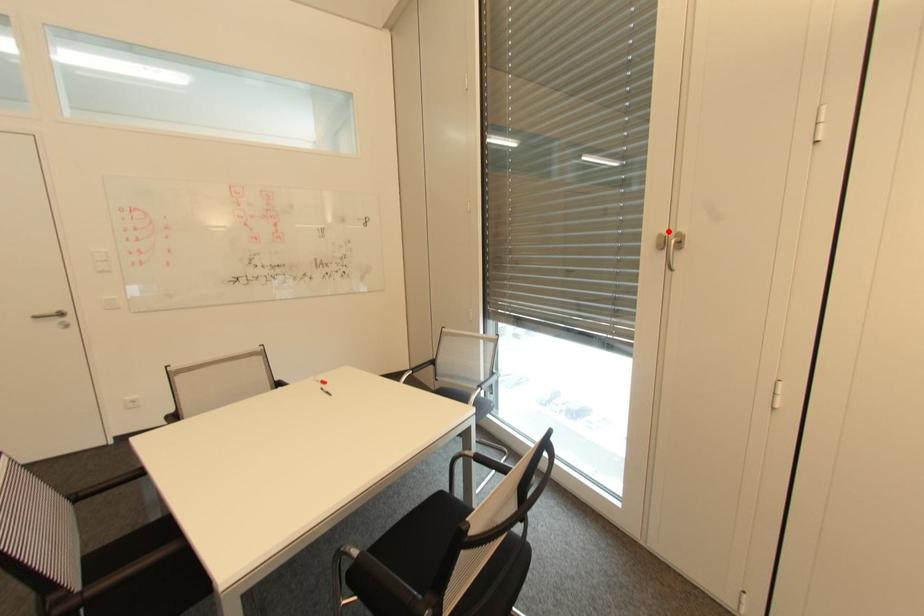
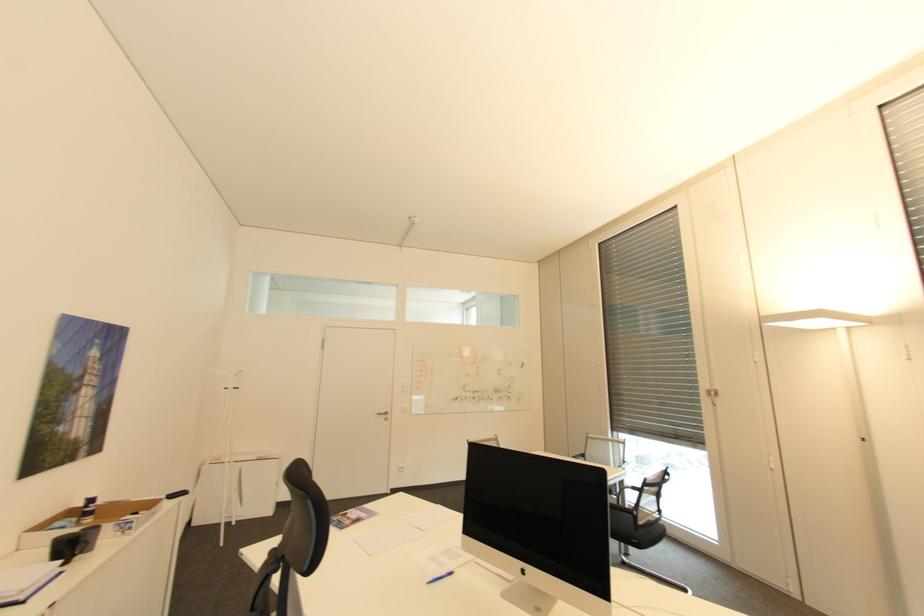
In the second image, find the point that corresponds to the highlighted location in the first image.

(713, 387)